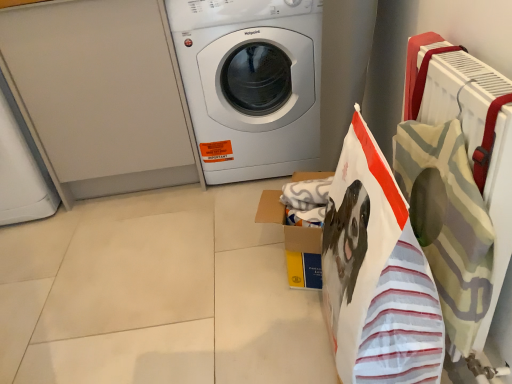
You are a GUI agent. You are given a task and a screenshot of the screen. Output one action in this format:
    pyautogui.click(x=<x>, y=<y>)
    Task: Click on the free spot above yellow cardboard box at center (from a real-world perspective)
    This screenshot has width=512, height=384.
    Given the screenshot: What is the action you would take?
    pyautogui.click(x=303, y=193)